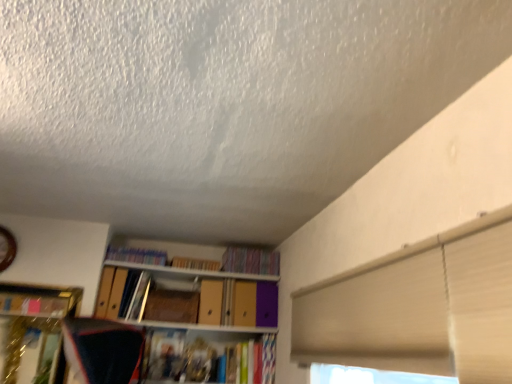
Question: Is matte plastic books at upper center, arranged as the 1th book when viewed from the left, oriented towards multicolored fabric book at upper center, marked as the third book in a left-to-right arrangement?

Choices:
 (A) yes
 (B) no

Answer: (B)

Question: Is matte plastic books at upper center, arranged as the 1th book when viewed from the left, in contact with multicolored fabric book at upper center, marked as the 1th book in a right-to-left arrangement?

Choices:
 (A) no
 (B) yes

Answer: (A)

Question: Is matte plastic books at upper center, arranged as the 3th book when viewed from the right, taller than multicolored fabric book at upper center, marked as the third book in a left-to-right arrangement?

Choices:
 (A) no
 (B) yes

Answer: (A)

Question: From a real-world perspective, is matte plastic books at upper center, arranged as the 3th book when viewed from the right, on multicolored fabric book at upper center, marked as the 1th book in a right-to-left arrangement?

Choices:
 (A) no
 (B) yes

Answer: (A)

Question: Can you confirm if matte plastic books at upper center, arranged as the 1th book when viewed from the left, is smaller than multicolored fabric book at upper center, marked as the third book in a left-to-right arrangement?

Choices:
 (A) no
 (B) yes

Answer: (B)

Question: From their relative heights in the image, would you say matte cardboard book at upper center, arranged as the 2th book when viewed from the right, is taller or shorter than wooden paperback book at center?

Choices:
 (A) short
 (B) tall

Answer: (A)

Question: Considering the relative positions of matte cardboard book at upper center, arranged as the 2th book when viewed from the right, and wooden paperback book at center in the image provided, is matte cardboard book at upper center, arranged as the 2th book when viewed from the right, to the left or to the right of wooden paperback book at center?

Choices:
 (A) right
 (B) left

Answer: (A)

Question: Does point (200, 263) appear closer or farther from the camera than point (182, 311)?

Choices:
 (A) farther
 (B) closer

Answer: (A)

Question: Considering their positions, is matte cardboard book at upper center, positioned as the 2th book in left-to-right order, located in front of or behind wooden paperback book at center?

Choices:
 (A) front
 (B) behind

Answer: (B)

Question: In the image, is wooden paperback book at center positioned in front of or behind multicolored fabric book at upper center, marked as the third book in a left-to-right arrangement?

Choices:
 (A) behind
 (B) front

Answer: (B)

Question: From the image's perspective, is wooden paperback book at center above or below multicolored fabric book at upper center, marked as the third book in a left-to-right arrangement?

Choices:
 (A) above
 (B) below

Answer: (B)

Question: Is wooden paperback book at center situated inside multicolored fabric book at upper center, marked as the third book in a left-to-right arrangement, or outside?

Choices:
 (A) inside
 (B) outside

Answer: (B)

Question: In terms of size, does wooden paperback book at center appear bigger or smaller than multicolored fabric book at upper center, marked as the third book in a left-to-right arrangement?

Choices:
 (A) big
 (B) small

Answer: (B)

Question: Is multicolored fabric book at upper center, marked as the 1th book in a right-to-left arrangement, wider or thinner than matte cardboard book at upper center, arranged as the 2th book when viewed from the right?

Choices:
 (A) wide
 (B) thin

Answer: (A)

Question: From a real-world perspective, is multicolored fabric book at upper center, marked as the 1th book in a right-to-left arrangement, above or below matte cardboard book at upper center, positioned as the 2th book in left-to-right order?

Choices:
 (A) above
 (B) below

Answer: (A)